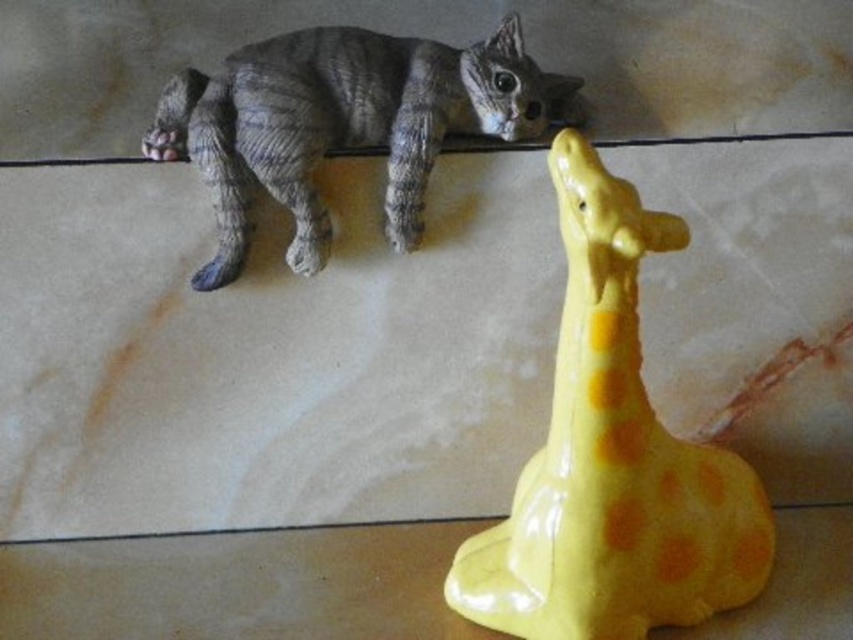
Is point (509, 604) positioned before point (288, 54)?

Yes, point (509, 604) is in front of point (288, 54).

Does yellow glossy giraffe at lower right lie behind gray textured cat at upper center?

No, it is not.

Who is more forward, (646, 472) or (415, 81)?

Positioned in front is point (646, 472).

You are a GUI agent. You are given a task and a screenshot of the screen. Output one action in this format:
    pyautogui.click(x=<x>, y=<y>)
    Task: Click on the yellow glossy giraffe at lower right
    This screenshot has width=853, height=640.
    Given the screenshot: What is the action you would take?
    pyautogui.click(x=612, y=460)

Does yellow glossy giraffe at lower right appear on the right side of transparent glass giraffe at lower right?

Yes, yellow glossy giraffe at lower right is to the right of transparent glass giraffe at lower right.

Can you confirm if yellow glossy giraffe at lower right is taller than transparent glass giraffe at lower right?

Correct, yellow glossy giraffe at lower right is much taller as transparent glass giraffe at lower right.

Between point (598, 452) and point (13, 550), which one is positioned behind?

Positioned behind is point (13, 550).

This screenshot has width=853, height=640. In order to click on yellow glossy giraffe at lower right in this screenshot , I will do `click(612, 460)`.

Who is positioned more to the left, transparent glass giraffe at lower right or gray textured cat at upper center?

gray textured cat at upper center

Who is shorter, transparent glass giraffe at lower right or gray textured cat at upper center?

transparent glass giraffe at lower right is shorter.

Does point (9, 636) lie behind point (347, 134)?

No, it is not.

Identify the location of transparent glass giraffe at lower right. (238, 586).